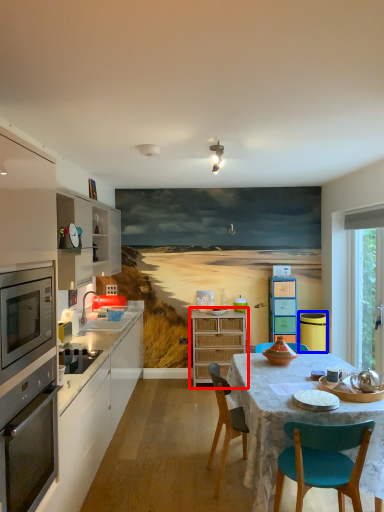
Question: Among these objects, which one is nearest to the camera, cabinetry (highlighted by a red box) or appliance (highlighted by a blue box)?

Choices:
 (A) cabinetry
 (B) appliance

Answer: (B)